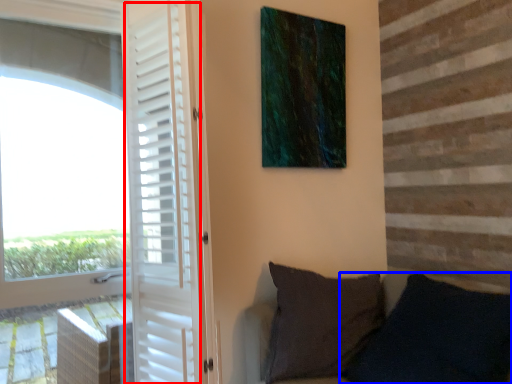
Question: Which point is closer to the camera, screen door (highlighted by a red box) or pillow (highlighted by a blue box)?

Choices:
 (A) screen door
 (B) pillow

Answer: (B)